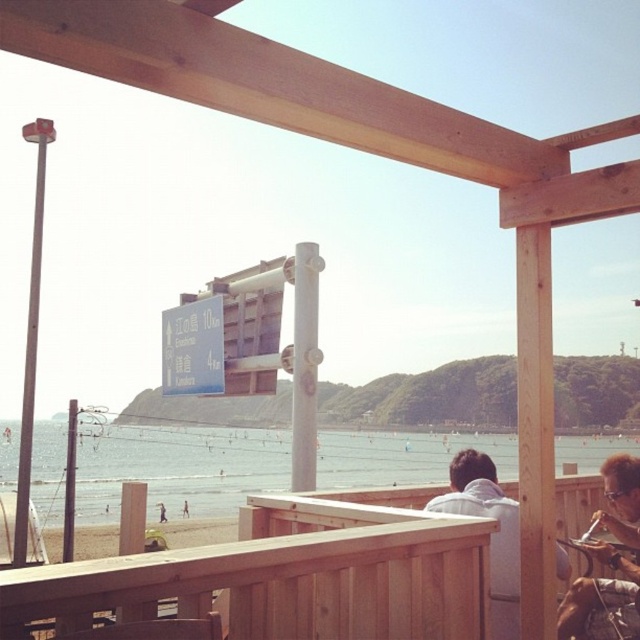
You are standing on the wooden structure looking out at the beach and sea. There is a blue road sign on a white pole in the midground. Where is the matte brown hair at upper right located relative to the blue road sign on white pole?

The matte brown hair at upper right is located at point (602,600), which is above and to the right of the blue road sign on white pole.

You are standing on the wooden structure and want to take a photo of the clear blue water at lower left and the tan skin person at lower center. Which object will appear larger in the photo?

The clear blue water at lower left will appear larger in the photo because it is taller than the tan skin person at lower center.

You are standing at the wooden structure overlooking the beach. There is a point marked at coordinates (180, 483) in the scene. If you want to place a small flag exactly at that point, how far in feet would you need to walk from your current position to reach it?

The point at coordinates (180, 483) is 47.54 feet away from the viewer, so you would need to walk 47.54 feet to place the flag there.